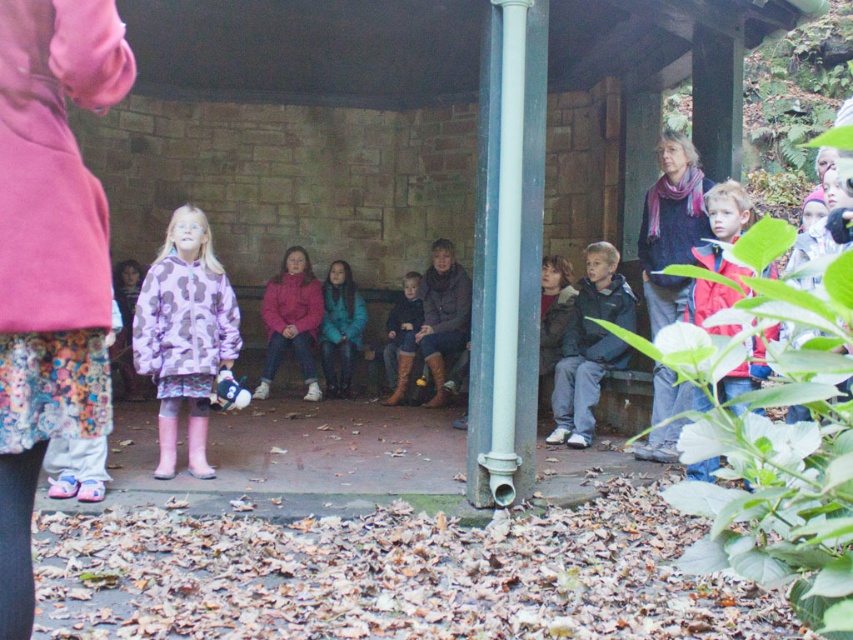
The width and height of the screenshot is (853, 640). In order to click on floral skirt at lower left in this screenshot , I will do `click(49, 257)`.

Consider the image. Is floral skirt at lower left shorter than purple printed jacket at center?

Correct, floral skirt at lower left is not as tall as purple printed jacket at center.

The width and height of the screenshot is (853, 640). I want to click on floral skirt at lower left, so click(49, 257).

The width and height of the screenshot is (853, 640). Find the location of `floral skirt at lower left`. floral skirt at lower left is located at coordinates (49, 257).

Based on the photo, which of these two, dark blue sweater at right or dark blue jacket at center, stands shorter?

dark blue jacket at center

Which of these two, dark blue sweater at right or dark blue jacket at center, stands taller?

dark blue sweater at right

The width and height of the screenshot is (853, 640). Find the location of `dark blue sweater at right`. dark blue sweater at right is located at coordinates (671, 227).

Is red matte jacket at right below matte black boots at center?

No, red matte jacket at right is not below matte black boots at center.

Between point (715, 298) and point (402, 296), which one is positioned in front?

Point (715, 298) is in front.

The width and height of the screenshot is (853, 640). Find the location of `red matte jacket at right`. red matte jacket at right is located at coordinates (727, 211).